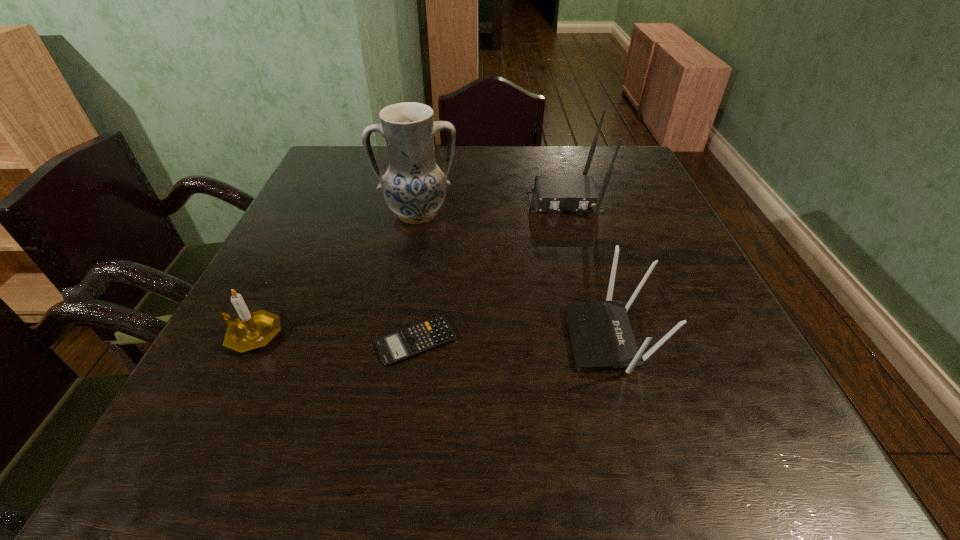
I want to click on vacant position located 0.290m on the front-facing side of the nearer router, so click(x=413, y=338).

Locate an element on the screen. The height and width of the screenshot is (540, 960). vacant area situated 0.210m on the front of the candle holder is located at coordinates (181, 476).

Image resolution: width=960 pixels, height=540 pixels. Find the location of `free spot located 0.400m on the right of the calculator`. free spot located 0.400m on the right of the calculator is located at coordinates (676, 341).

Find the location of a particular element. object present at the far edge is located at coordinates (551, 193).

Where is `object present at the left edge`? This screenshot has width=960, height=540. object present at the left edge is located at coordinates (249, 331).

You are a GUI agent. You are given a task and a screenshot of the screen. Output one action in this format:
    pyautogui.click(x=<x>, y=<y>)
    Task: Click on the object that is positioned at the far right corner
    This screenshot has width=960, height=540.
    Given the screenshot: What is the action you would take?
    pyautogui.click(x=551, y=193)

Find the location of a particular element. vacant region at the far edge of the desktop is located at coordinates 515,177.

Locate an element on the screen. The width and height of the screenshot is (960, 540). vacant region at the near edge of the desktop is located at coordinates click(x=525, y=472).

Find the location of a particular element. The height and width of the screenshot is (540, 960). vacant region at the left edge is located at coordinates (255, 369).

Where is `free space at the right edge`? This screenshot has width=960, height=540. free space at the right edge is located at coordinates (660, 274).